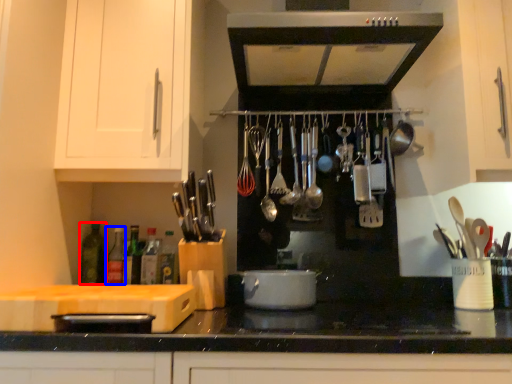
Question: Which of the following is the closest to the observer, bottle (highlighted by a red box) or bottle (highlighted by a blue box)?

Choices:
 (A) bottle
 (B) bottle

Answer: (A)